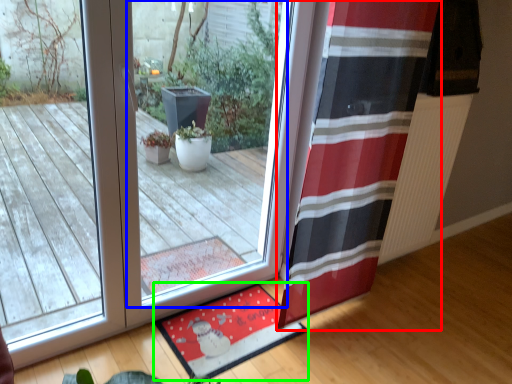
Question: Considering the real-world distances, which object is farthest from curtain (highlighted by a red box)? window (highlighted by a blue box) or mat (highlighted by a green box)?

Choices:
 (A) window
 (B) mat

Answer: (A)